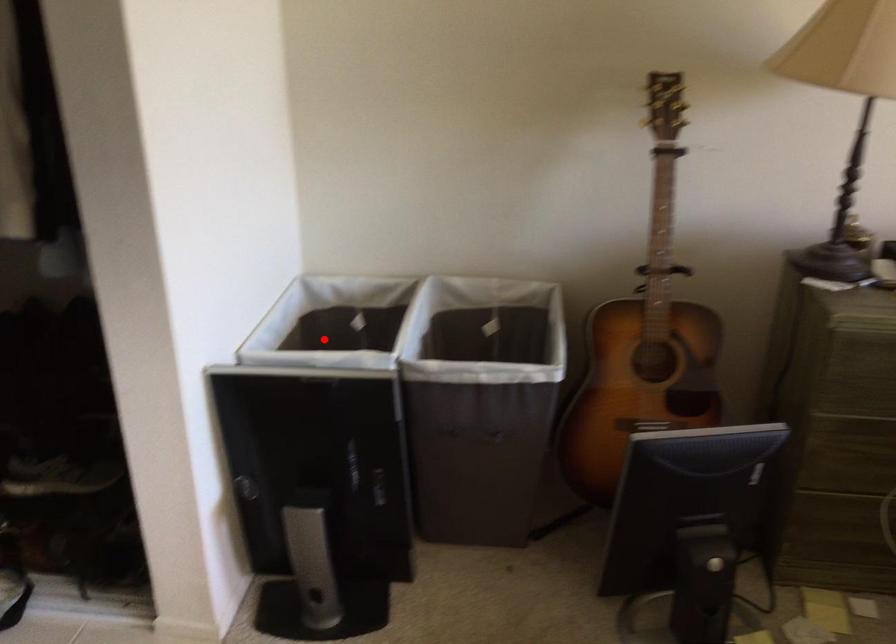
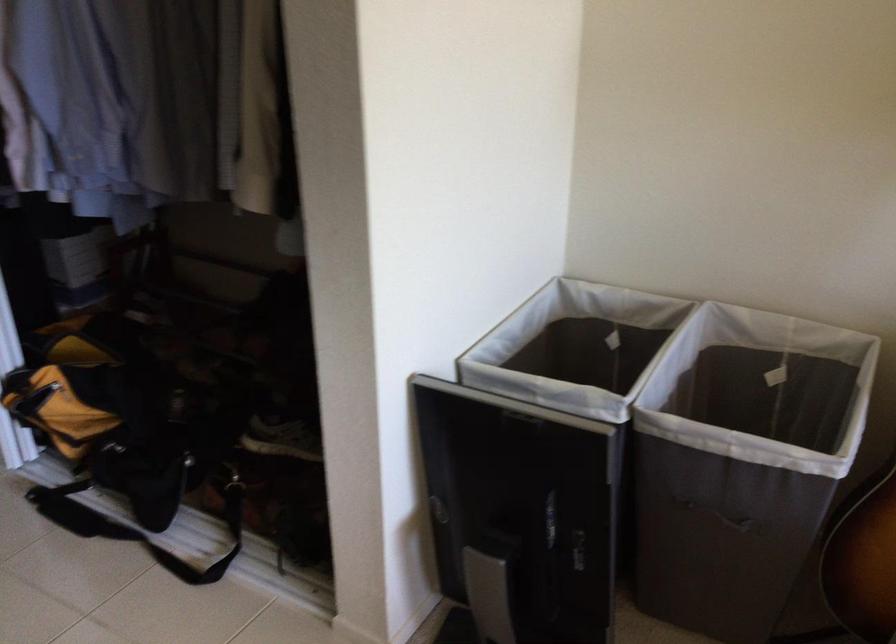
Question: I am providing you with two images of the same scene from different viewpoints. A red point is shown in image1. For the corresponding object point in image2, is it positioned nearer or farther from the camera?

Choices:
 (A) Nearer
 (B) Farther

Answer: (A)